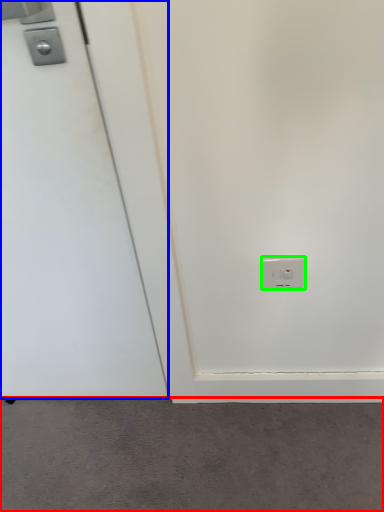
Question: Which is nearer to the concrete (highlighted by a red box)? door (highlighted by a blue box) or power plugs and sockets (highlighted by a green box).

Choices:
 (A) door
 (B) power plugs and sockets

Answer: (A)